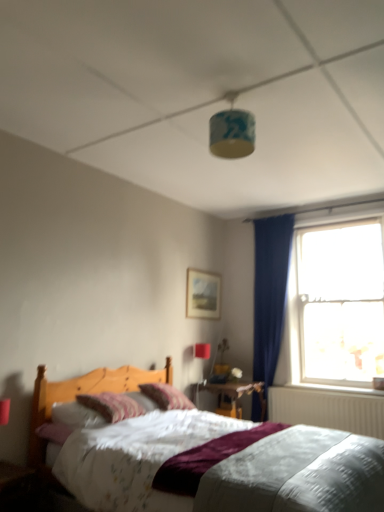
Locate an element on the screen. Image resolution: width=384 pixels, height=512 pixels. free point above white glossy window sill at lower right (from a real-world perspective) is located at coordinates (330, 386).